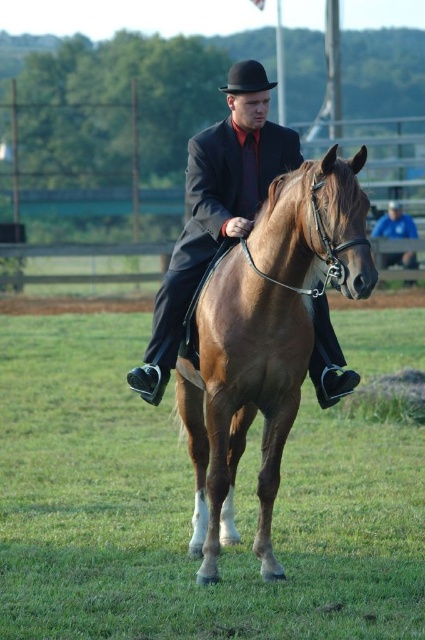
You are a photographer standing near the brown glossy horse at center. You want to take a photo of the rider and the horse. The camera you have can focus on subjects up to 4 meters away. Will you be able to focus on the rider and the horse?

The rider and the horse are 4.41 meters apart. Since your camera can focus up to 4 meters, you will not be able to focus on them because the distance is greater than the camera can handle.